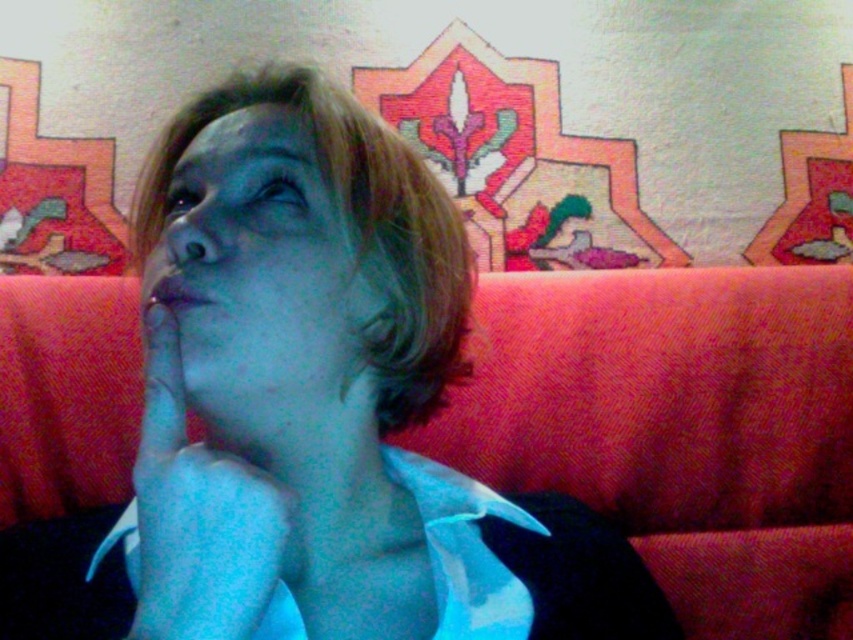
You are standing in a room and see the orange fabric couch at center. Can you estimate the coordinates of the couch?

The orange fabric couch at center is located at point (x=677, y=428).

You are a photographer adjusting your camera settings to capture the scene with the orange fabric couch at center and the blue matte hand at center. Since you want to focus on the foreground object, which object should you prioritize in your focus settings?

The orange fabric couch at center is closer to the viewer than the blue matte hand at center, so you should prioritize focusing on the orange fabric couch at center to ensure it is sharp in the foreground.

In the scene shown: You are an interior designer assessing the layout of a living room. You see the orange fabric couch at center and the blue matte face at center. Which object is located below the other?

The orange fabric couch at center is positioned under blue matte face at center, so the couch is below the face.